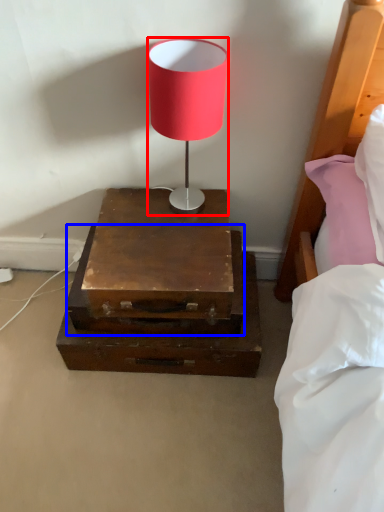
Question: Which of the following is the farthest to the observer, lamp (highlighted by a red box) or drawer (highlighted by a blue box)?

Choices:
 (A) lamp
 (B) drawer

Answer: (B)